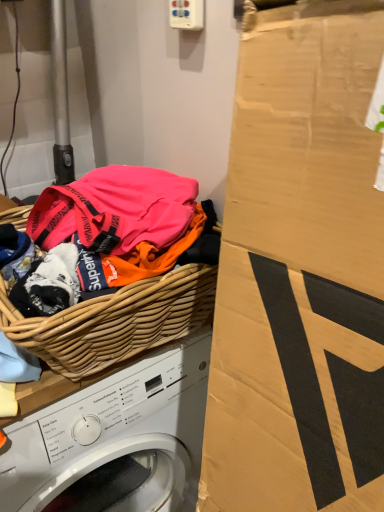
This screenshot has width=384, height=512. Identify the location of woven wood basket at left. (115, 322).

This screenshot has height=512, width=384. Describe the element at coordinates (115, 322) in the screenshot. I see `woven wood basket at left` at that location.

This screenshot has height=512, width=384. I want to click on white woven basket at upper left, so click(x=115, y=436).

Describe the element at coordinates (115, 436) in the screenshot. I see `white woven basket at upper left` at that location.

Based on the photo, what is the approximate width of white woven basket at upper left?

white woven basket at upper left is 58.16 centimeters wide.

Measure the distance between point (107, 460) and camera.

The distance of point (107, 460) from camera is 31.50 inches.

Locate an element on the screen. woven wood basket at left is located at coordinates (115, 322).

Does white woven basket at upper left appear on the right side of woven wood basket at left?

In fact, white woven basket at upper left is to the left of woven wood basket at left.

Between white woven basket at upper left and woven wood basket at left, which one is positioned in front?

woven wood basket at left.

Which is behind, point (1, 490) or point (97, 344)?

The point (1, 490) is farther from the camera.

From the image's perspective, is white woven basket at upper left under woven wood basket at left?

Yes.

From a real-world perspective, is white woven basket at upper left positioned over woven wood basket at left based on gravity?

No.

Can you confirm if white woven basket at upper left is thinner than woven wood basket at left?

Incorrect, the width of white woven basket at upper left is not less than that of woven wood basket at left.

Is white woven basket at upper left taller or shorter than woven wood basket at left?

white woven basket at upper left is taller than woven wood basket at left.

Considering the sizes of objects white woven basket at upper left and woven wood basket at left in the image provided, who is smaller, white woven basket at upper left or woven wood basket at left?

With smaller size is woven wood basket at left.

Is woven wood basket at left inside white woven basket at upper left?

No.

Is white woven basket at upper left positioned far away from woven wood basket at left?

They are positioned close to each other.

Is white woven basket at upper left oriented away from woven wood basket at left?

white woven basket at upper left is not turned away from woven wood basket at left.

Identify the location of basket above the white woven basket at upper left (from a real-world perspective). (115, 322).

Consider the image. Which is more to the right, woven wood basket at left or white woven basket at upper left?

From the viewer's perspective, woven wood basket at left appears more on the right side.

Based on the photo, considering the positions of objects woven wood basket at left and white woven basket at upper left in the image provided, who is behind, woven wood basket at left or white woven basket at upper left?

white woven basket at upper left is more distant.

Considering the points (20, 345) and (185, 425), which point is behind, point (20, 345) or point (185, 425)?

The point (185, 425) is farther from the camera.

From the image's perspective, which is below, woven wood basket at left or white woven basket at upper left?

white woven basket at upper left is shown below in the image.

From a real-world perspective, does woven wood basket at left stand above white woven basket at upper left?

Yes.

Considering the relative sizes of woven wood basket at left and white woven basket at upper left in the image provided, is woven wood basket at left wider than white woven basket at upper left?

No, woven wood basket at left is not wider than white woven basket at upper left.

Which of these two, woven wood basket at left or white woven basket at upper left, stands taller?

white woven basket at upper left.

Considering the relative sizes of woven wood basket at left and white woven basket at upper left in the image provided, is woven wood basket at left smaller than white woven basket at upper left?

Yes.

Do you think woven wood basket at left is within white woven basket at upper left, or outside of it?

woven wood basket at left is outside white woven basket at upper left.

Is woven wood basket at left next to white woven basket at upper left?

They are not placed beside each other.

Does woven wood basket at left turn towards white woven basket at upper left?

No, woven wood basket at left is not aimed at white woven basket at upper left.

What's the angular difference between woven wood basket at left and white woven basket at upper left's facing directions?

woven wood basket at left and white woven basket at upper left are facing 1.62 degrees away from each other.

I want to click on washing machine that is behind the woven wood basket at left, so [115, 436].

This screenshot has height=512, width=384. In the image, there is a white woven basket at upper left. What are the coordinates of `basket above it (from the image's perspective)` in the screenshot? It's located at 115,322.

Find the location of a particular element. washing machine that is under the woven wood basket at left (from a real-world perspective) is located at coordinates (115, 436).